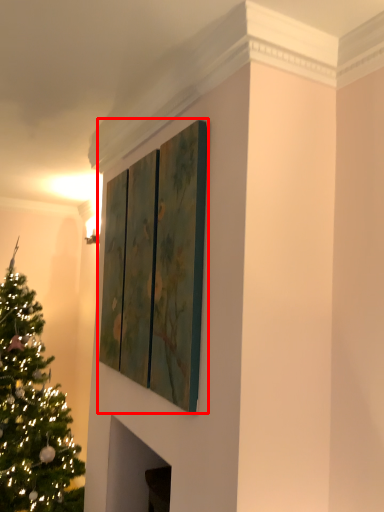
Question: From the image's perspective, considering the relative positions of window (annotated by the red box) and christmas tree in the image provided, where is window (annotated by the red box) located with respect to the staircase?

Choices:
 (A) below
 (B) above

Answer: (B)